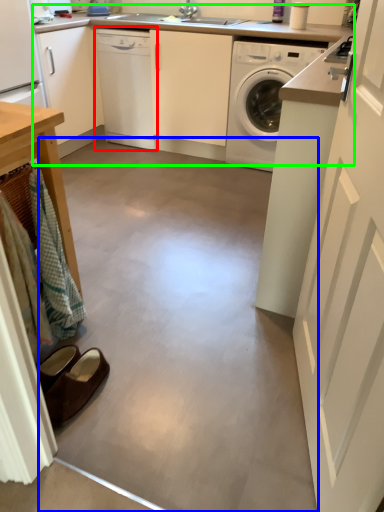
Question: Based on their relative distances, which object is farther from dishwasher (highlighted by a red box)? Choose from concrete (highlighted by a blue box) and counter top (highlighted by a green box).

Choices:
 (A) concrete
 (B) counter top

Answer: (A)